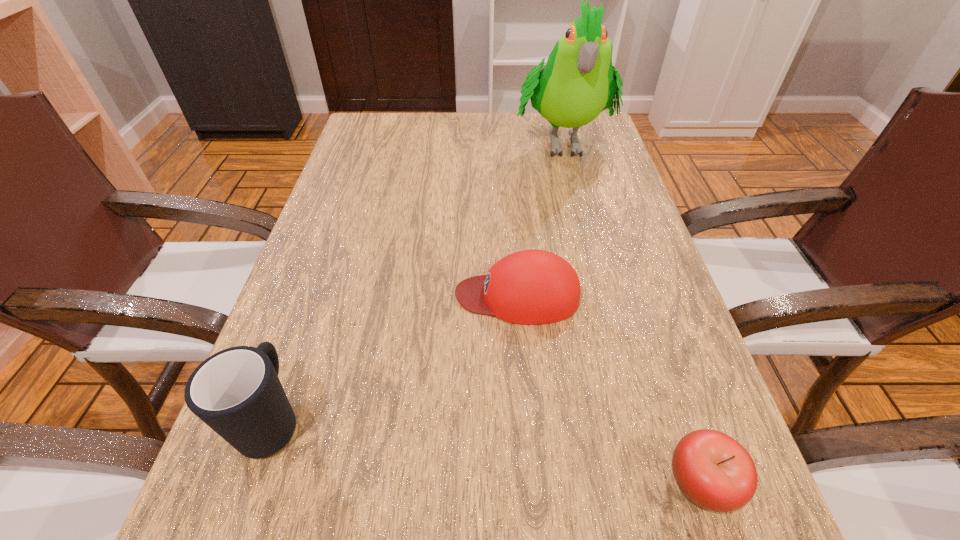
Where is `free spot between the baseball cap and the apple`? free spot between the baseball cap and the apple is located at coordinates (610, 389).

At what (x,y) coordinates should I click in order to perform the action: click on empty space that is in between the apple and the baseball cap. Please return your answer as a coordinate pair (x, y). Image resolution: width=960 pixels, height=540 pixels. Looking at the image, I should click on (610, 389).

Locate an element on the screen. free space between the third nearest object and the parakeet is located at coordinates (540, 218).

Find the location of a particular element. The height and width of the screenshot is (540, 960). blank region between the second farthest object and the leftmost object is located at coordinates (396, 356).

I want to click on object that stands as the second closest to the farthest object, so tap(236, 392).

Choose which object is the second nearest neighbor to the baseball cap. Please provide its 2D coordinates. Your answer should be formatted as a tuple, i.e. [(x, y)], where the tuple contains the x and y coordinates of a point satisfying the conditions above.

[(236, 392)]

I want to click on free spot that satisfies the following two spatial constraints: 1. on the back side of the apple; 2. on the front-facing side of the baseball cap, so (x=638, y=295).

This screenshot has height=540, width=960. Find the location of `vacant space that satisfies the following two spatial constraints: 1. on the beak of the apple; 2. on the right side of the farthest object`. vacant space that satisfies the following two spatial constraints: 1. on the beak of the apple; 2. on the right side of the farthest object is located at coordinates (648, 482).

Locate an element on the screen. vacant area in the image that satisfies the following two spatial constraints: 1. on the beak of the farthest object; 2. on the left side of the apple is located at coordinates (648, 482).

The image size is (960, 540). Identify the location of vacant region that satisfies the following two spatial constraints: 1. on the beak of the apple; 2. on the right side of the tallest object. (648, 482).